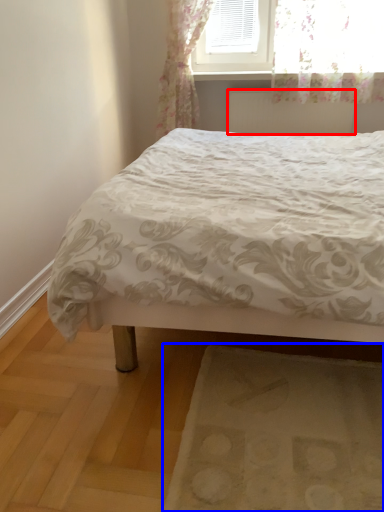
Question: Which point is closer to the camera, radiator (highlighted by a red box) or mat (highlighted by a blue box)?

Choices:
 (A) radiator
 (B) mat

Answer: (B)